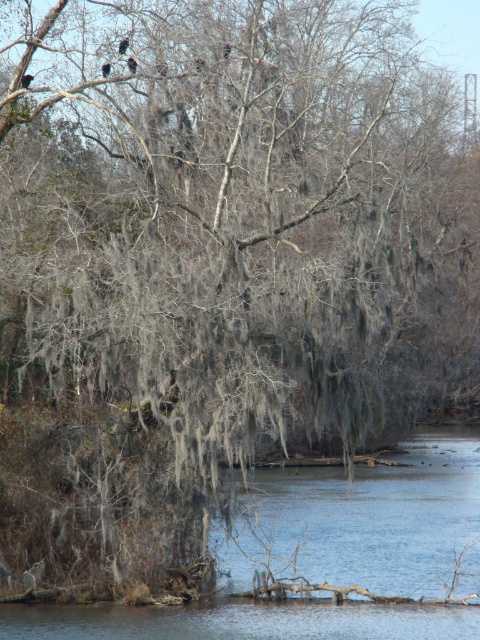
You are standing in the serene natural scene with the dense forest and calm water. You notice a point in the image at coordinates point (25, 81). What object does this point correspond to?

The point (25, 81) corresponds to the black glossy bird at upper center.

You are an ornithologist observing the scene. You notice two types of feathers in the upper center area. Which of the two, the dark gray feathers at upper center or the dark brown feathers at upper center, is positioned to the right side?

The dark gray feathers at upper center are to the right of the dark brown feathers at upper center.

You are an ornithologist observing the scene. You notice a black glossy bird at upper center and dark gray feathers at upper center. Which object is positioned more to the left?

The black glossy bird at upper center is positioned more to the left than the dark gray feathers at upper center.